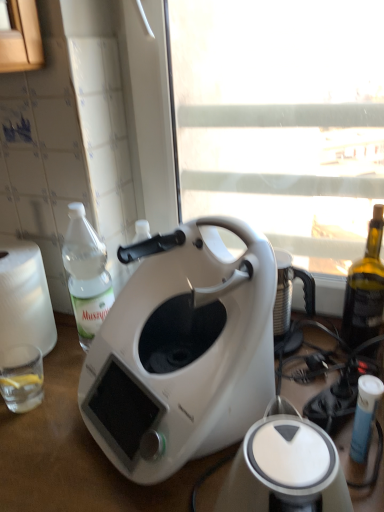
Question: From the image's perspective, would you say clear glass at lower left is shown under white matte table at center?

Choices:
 (A) yes
 (B) no

Answer: (B)

Question: Considering the relative sizes of clear glass at lower left and white matte table at center in the image provided, is clear glass at lower left smaller than white matte table at center?

Choices:
 (A) no
 (B) yes

Answer: (B)

Question: From a real-world perspective, is clear glass at lower left under white matte table at center?

Choices:
 (A) no
 (B) yes

Answer: (A)

Question: Does clear glass at lower left have a lesser height compared to white matte table at center?

Choices:
 (A) no
 (B) yes

Answer: (B)

Question: Does clear glass at lower left appear on the left side of white matte table at center?

Choices:
 (A) no
 (B) yes

Answer: (A)

Question: Considering the positions of white plastic toaster at center and white matte coffee maker at center in the image, is white plastic toaster at center bigger or smaller than white matte coffee maker at center?

Choices:
 (A) small
 (B) big

Answer: (A)

Question: Considering the positions of point (233, 467) and point (206, 347), is point (233, 467) closer or farther from the camera than point (206, 347)?

Choices:
 (A) farther
 (B) closer

Answer: (B)

Question: Is white plastic toaster at center wider or thinner than white matte coffee maker at center?

Choices:
 (A) wide
 (B) thin

Answer: (B)

Question: From a real-world perspective, is white plastic toaster at center positioned above or below white matte coffee maker at center?

Choices:
 (A) below
 (B) above

Answer: (A)

Question: Is point (97, 262) positioned closer to the camera than point (354, 100)?

Choices:
 (A) farther
 (B) closer

Answer: (A)

Question: From a real-world perspective, relative to white plastic window screen at center, is clear plastic bottle at left vertically above or below?

Choices:
 (A) above
 (B) below

Answer: (B)

Question: Considering their positions, is clear plastic bottle at left located in front of or behind white plastic window screen at center?

Choices:
 (A) behind
 (B) front

Answer: (A)

Question: Is clear plastic bottle at left wider or thinner than white plastic window screen at center?

Choices:
 (A) thin
 (B) wide

Answer: (B)

Question: Considering their positions, is white plastic window screen at center located in front of or behind white matte coffee maker at center?

Choices:
 (A) behind
 (B) front

Answer: (A)

Question: Considering the positions of point (276, 55) and point (175, 361), is point (276, 55) closer or farther from the camera than point (175, 361)?

Choices:
 (A) farther
 (B) closer

Answer: (A)